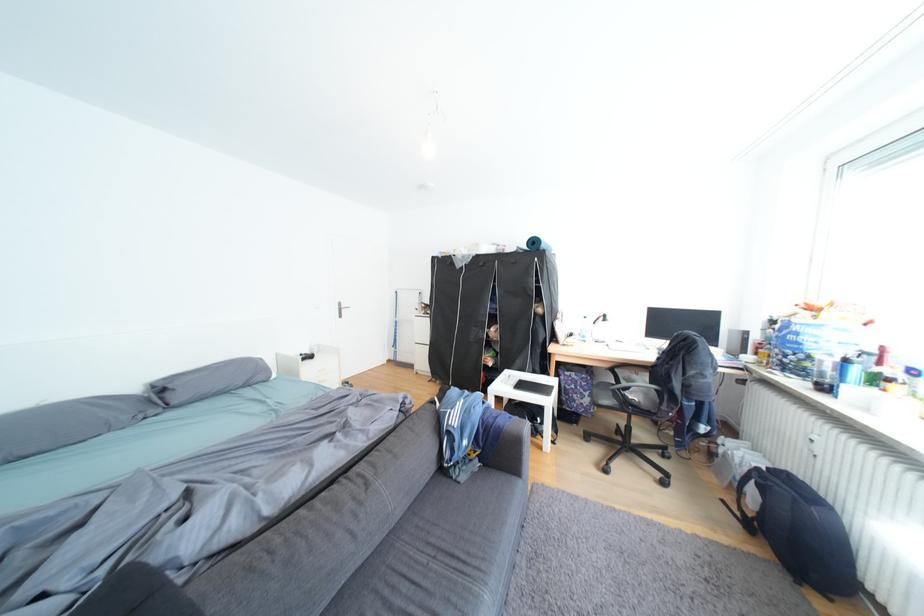
Where would you sit the black chair sitting surface? Please return your answer as a coordinate pair (x, y).

(640, 395)